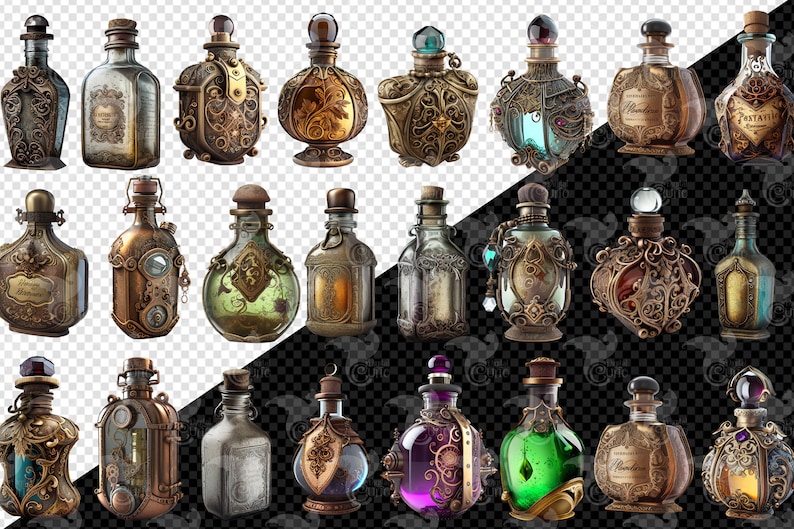
Image resolution: width=794 pixels, height=529 pixels. I want to click on round glass top that glows on 2nd row of potion bottles, so click(648, 196).